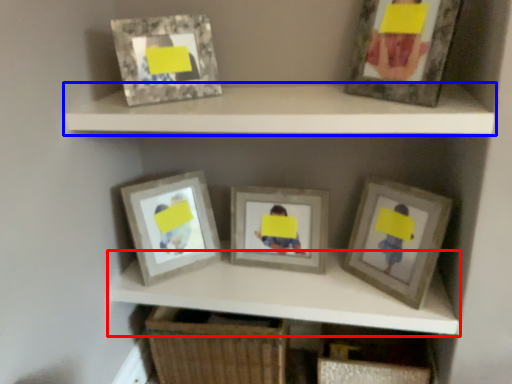
Question: Among these objects, which one is farthest to the camera, cabinet (highlighted by a red box) or shelf (highlighted by a blue box)?

Choices:
 (A) cabinet
 (B) shelf

Answer: (A)